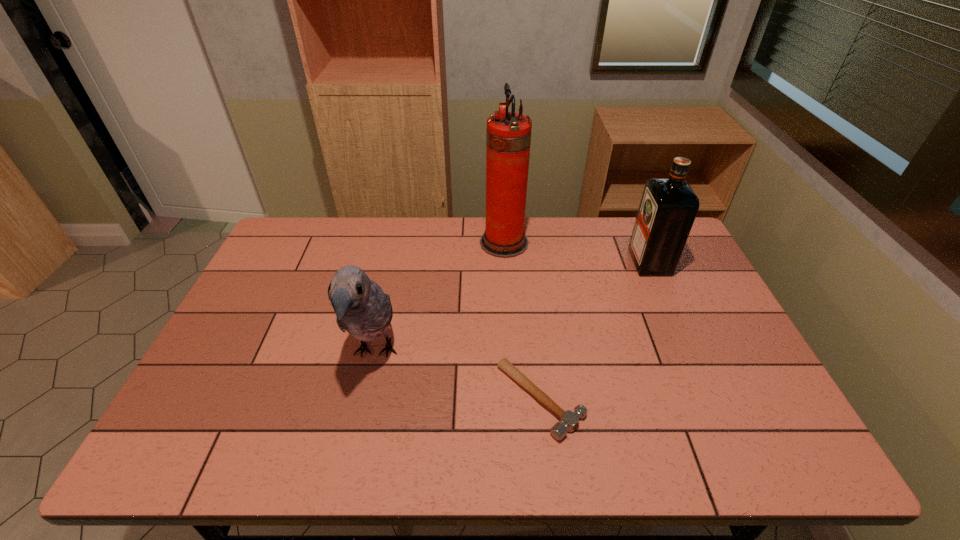
Identify the location of blank space located 0.130m on the front-facing side of the leftmost object. The width and height of the screenshot is (960, 540). (353, 453).

The height and width of the screenshot is (540, 960). Identify the location of vacant space located on the back of the hammer. (531, 317).

Find the location of a particular element. The height and width of the screenshot is (540, 960). fire extinguisher that is at the far edge is located at coordinates click(x=508, y=137).

The image size is (960, 540). Find the location of `liquor that is at the far edge`. liquor that is at the far edge is located at coordinates (668, 207).

The height and width of the screenshot is (540, 960). I want to click on object that is at the near edge, so click(569, 421).

Identify the location of object that is at the right edge. (668, 207).

Identify the location of object present at the far right corner. The height and width of the screenshot is (540, 960). (668, 207).

In the image, there is a desktop. Where is `vacant region at the far edge`? The width and height of the screenshot is (960, 540). vacant region at the far edge is located at coordinates (541, 248).

This screenshot has height=540, width=960. What are the coordinates of `free spot at the near edge of the desktop` in the screenshot? It's located at (601, 460).

Image resolution: width=960 pixels, height=540 pixels. Identify the location of vacant space at the right edge of the desktop. (687, 334).